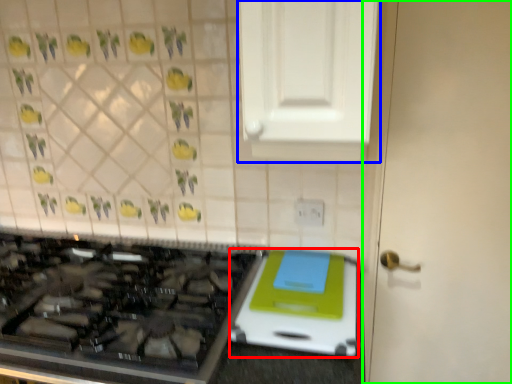
Question: Estimate the real-world distances between objects in this image. Which object is closer to appliance (highlighted by a red box), cabinetry (highlighted by a blue box) or door (highlighted by a green box)?

Choices:
 (A) cabinetry
 (B) door

Answer: (B)